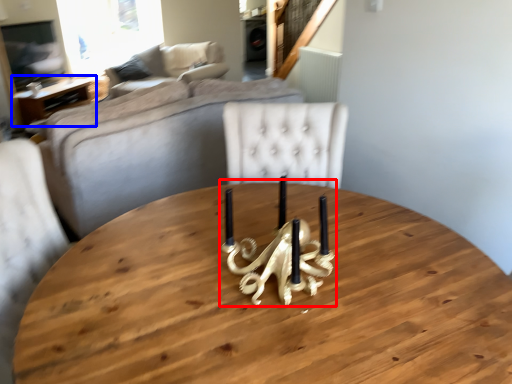
Question: Which of the following is the farthest to the observer, candle holder (highlighted by a red box) or table (highlighted by a blue box)?

Choices:
 (A) candle holder
 (B) table

Answer: (B)